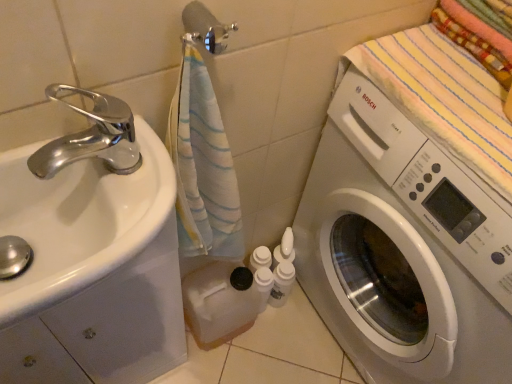
Question: Is white glossy washing machine at right at the left side of white glossy sink at left?

Choices:
 (A) no
 (B) yes

Answer: (A)

Question: Considering the relative positions of white glossy washing machine at right and white glossy sink at left in the image provided, is white glossy washing machine at right to the right of white glossy sink at left from the viewer's perspective?

Choices:
 (A) yes
 (B) no

Answer: (A)

Question: Would you say white glossy washing machine at right is outside white glossy sink at left?

Choices:
 (A) no
 (B) yes

Answer: (B)

Question: Is white glossy washing machine at right far from white glossy sink at left?

Choices:
 (A) yes
 (B) no

Answer: (B)

Question: From a real-world perspective, is white glossy washing machine at right over white glossy sink at left?

Choices:
 (A) no
 (B) yes

Answer: (A)

Question: Is silver metallic towel bar at upper center in front of or behind white glossy sink at left in the image?

Choices:
 (A) behind
 (B) front

Answer: (A)

Question: Looking at their shapes, would you say silver metallic towel bar at upper center is wider or thinner than white glossy sink at left?

Choices:
 (A) thin
 (B) wide

Answer: (A)

Question: From the image's perspective, is silver metallic towel bar at upper center located above or below white glossy sink at left?

Choices:
 (A) below
 (B) above

Answer: (B)

Question: Considering the relative positions of silver metallic towel bar at upper center and white glossy sink at left in the image provided, is silver metallic towel bar at upper center to the left or to the right of white glossy sink at left?

Choices:
 (A) left
 (B) right

Answer: (B)

Question: Considering the positions of point (466, 99) and point (205, 16), is point (466, 99) closer or farther from the camera than point (205, 16)?

Choices:
 (A) farther
 (B) closer

Answer: (A)

Question: Is striped cotton beach towel at upper right to the left or to the right of silver metallic towel bar at upper center in the image?

Choices:
 (A) right
 (B) left

Answer: (A)

Question: In terms of height, does striped cotton beach towel at upper right look taller or shorter compared to silver metallic towel bar at upper center?

Choices:
 (A) tall
 (B) short

Answer: (A)

Question: Looking at the image, does striped cotton beach towel at upper right seem bigger or smaller compared to silver metallic towel bar at upper center?

Choices:
 (A) big
 (B) small

Answer: (A)

Question: From a real-world perspective, is white glossy sink at left positioned above or below white glossy washing machine at right?

Choices:
 (A) above
 (B) below

Answer: (A)

Question: Looking at the image, does white glossy sink at left seem bigger or smaller compared to white glossy washing machine at right?

Choices:
 (A) big
 (B) small

Answer: (B)